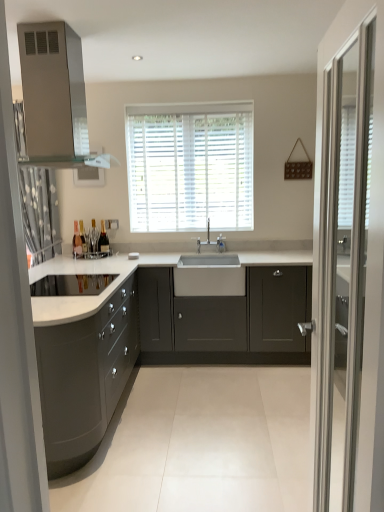
Locate an element on the screen. The height and width of the screenshot is (512, 384). space that is in front of satin nickel faucet at center is located at coordinates (230, 251).